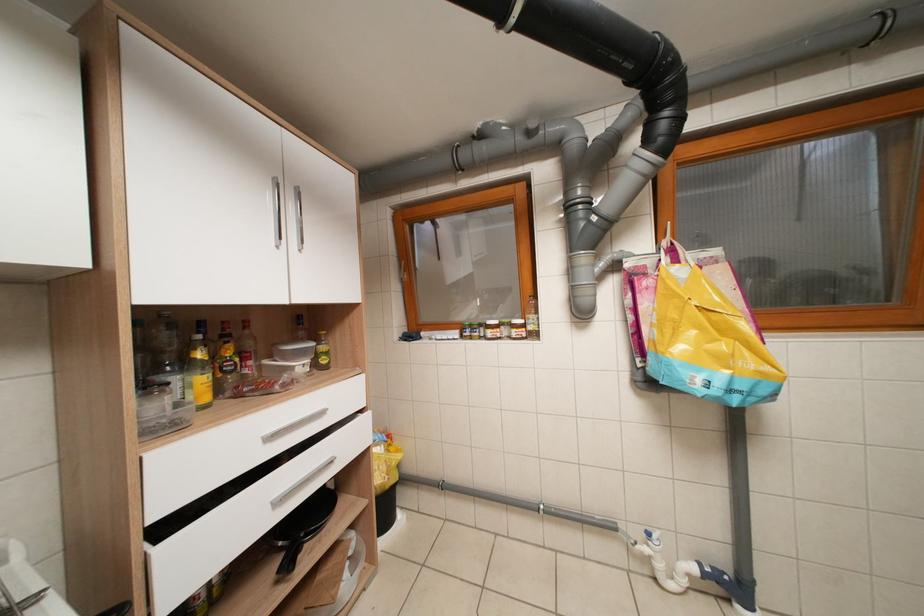
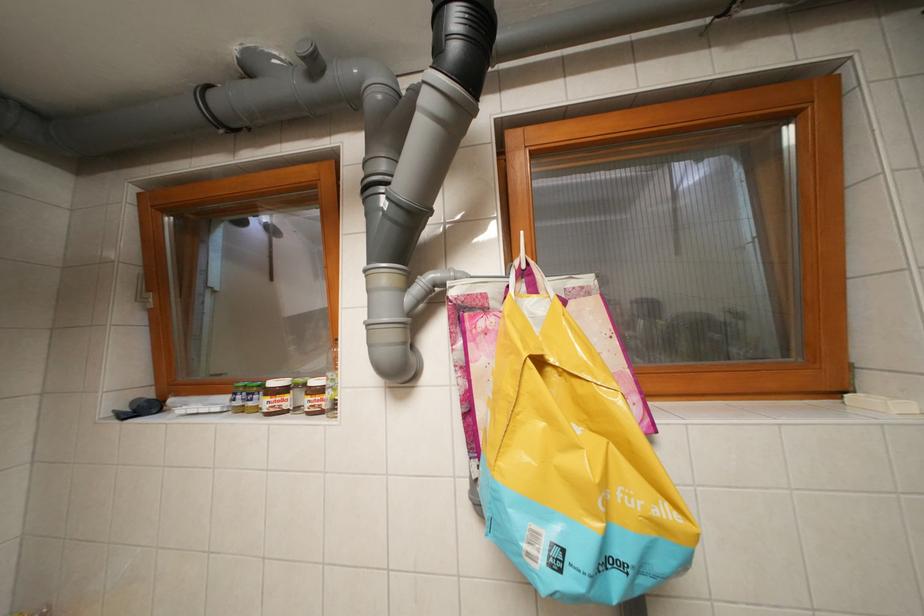
The images are taken continuously from a first-person perspective. In which direction are you moving?

The movement direction of the cameraman is right, forward.